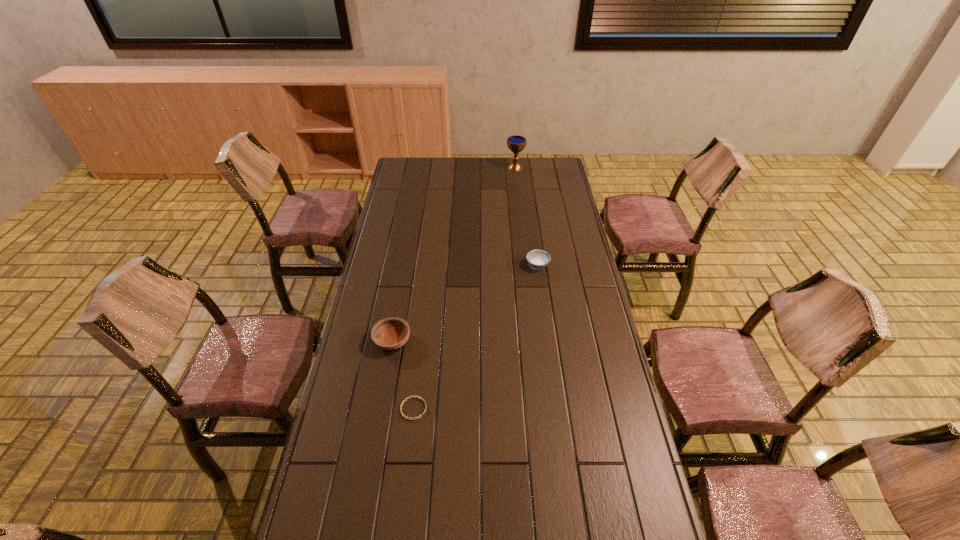
What are the coordinates of `vacant space located 0.170m on the back of the third tallest object` in the screenshot? It's located at (533, 233).

I want to click on vacant space positioned 0.150m on the surface of the bracelet showing star-shaped elements, so click(x=474, y=409).

Where is `object positioned at the far edge`? This screenshot has width=960, height=540. object positioned at the far edge is located at coordinates [x=516, y=143].

This screenshot has width=960, height=540. In order to click on object that is at the left edge in this screenshot , I will do 392,333.

Image resolution: width=960 pixels, height=540 pixels. Identify the location of object located in the right edge section of the desktop. (537, 259).

Identify the location of free space at the far edge of the desktop. The image size is (960, 540). (476, 158).

Find the location of a particular element. This screenshot has width=960, height=540. vacant space at the left edge is located at coordinates (393, 224).

In the image, there is a desktop. Where is `free space at the right edge`? This screenshot has width=960, height=540. free space at the right edge is located at coordinates (551, 262).

You are a GUI agent. You are given a task and a screenshot of the screen. Output one action in this format:
    pyautogui.click(x=<x>, y=<y>)
    Task: Click on the free space between the second nearest object and the nearest object
    
    Given the screenshot: What is the action you would take?
    pyautogui.click(x=403, y=375)

Locate an element on the screen. vacant region between the third nearest object and the tallest object is located at coordinates (526, 217).